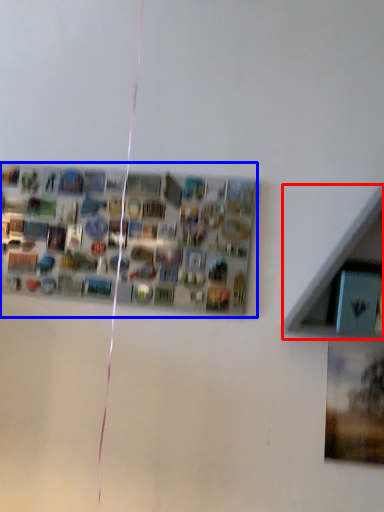
Question: Which object is further to the camera taking this photo, shelf (highlighted by a red box) or bulletin board (highlighted by a blue box)?

Choices:
 (A) shelf
 (B) bulletin board

Answer: (B)